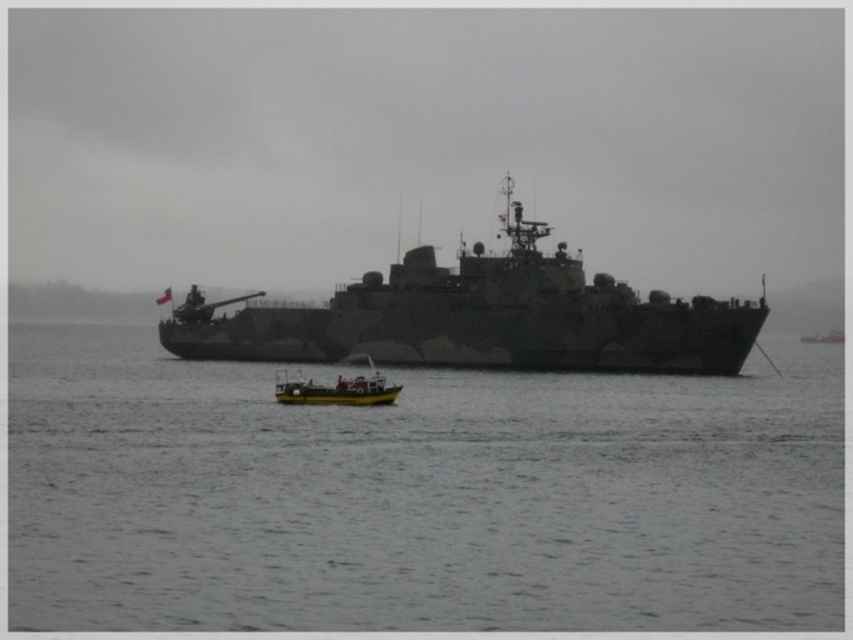
Question: Which point is farther to the camera?

Choices:
 (A) yellow matte boat at center
 (B) camouflage matte ship at center
 (C) gray matte water at center

Answer: (B)

Question: Among these points, which one is farthest from the camera?

Choices:
 (A) (218, 355)
 (B) (374, 394)

Answer: (A)

Question: Which of the following is the closest to the observer?

Choices:
 (A) camouflage matte ship at center
 (B) gray matte water at center

Answer: (B)

Question: Can you confirm if gray matte water at center is bigger than camouflage matte ship at center?

Choices:
 (A) no
 (B) yes

Answer: (A)

Question: Does camouflage matte ship at center have a smaller size compared to yellow matte boat at center?

Choices:
 (A) no
 (B) yes

Answer: (A)

Question: Does gray matte water at center lie in front of yellow matte boat at center?

Choices:
 (A) no
 (B) yes

Answer: (B)